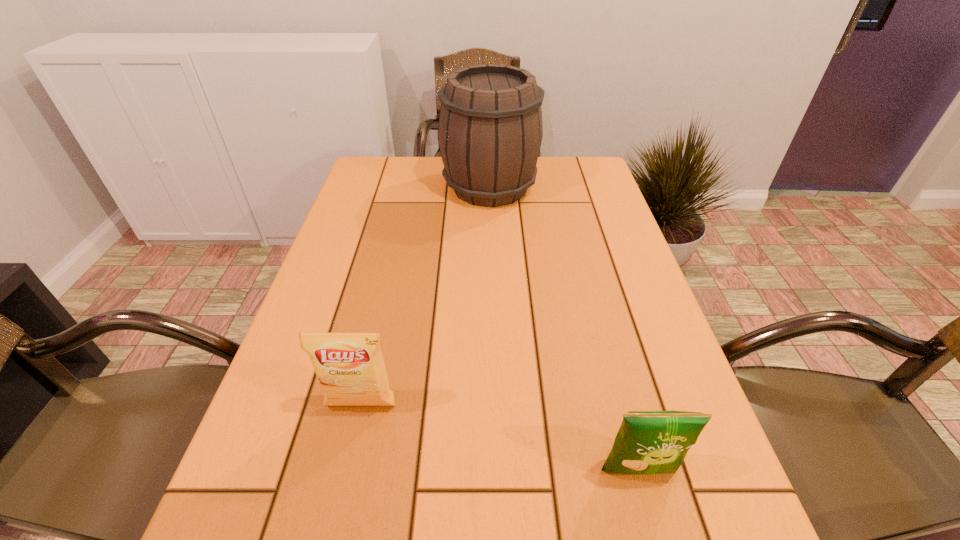
Find the location of `object located at the right edge`. object located at the right edge is located at coordinates (648, 442).

Where is `vacant space at the left edge of the desktop`? vacant space at the left edge of the desktop is located at coordinates (334, 303).

In the image, there is a desktop. Where is `free space at the right edge`? The height and width of the screenshot is (540, 960). free space at the right edge is located at coordinates (655, 299).

This screenshot has height=540, width=960. What are the coordinates of `vacant point at the far left corner` in the screenshot? It's located at (365, 184).

The image size is (960, 540). In the image, there is a desktop. What are the coordinates of `vacant region at the far right corner` in the screenshot? It's located at pyautogui.click(x=605, y=190).

In order to click on vacant area between the farther crisp (potato chip) and the rightmost object in this screenshot , I will do `click(500, 438)`.

The height and width of the screenshot is (540, 960). In order to click on vacant area that lies between the wine bucket and the shortest object in this screenshot , I will do `click(564, 329)`.

The height and width of the screenshot is (540, 960). I want to click on empty space between the shorter crisp (potato chip) and the tallest object, so click(564, 329).

This screenshot has width=960, height=540. I want to click on free spot between the leftmost object and the right crisp (potato chip), so click(x=500, y=438).

The image size is (960, 540). Identify the location of unoccupied position between the leftmost object and the shortest object. (500, 438).